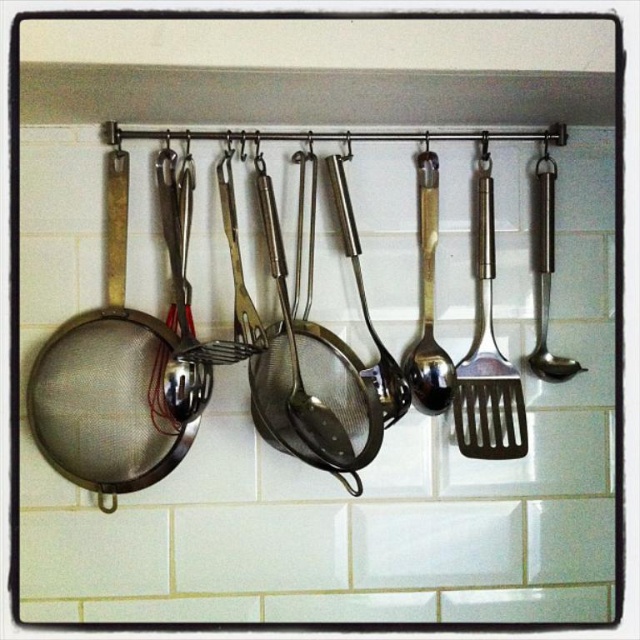
Question: Which of the following is the farthest from the observer?

Choices:
 (A) satin gold spoon at center
 (B) satin silver mesh strainer at center
 (C) satin silver strainer at center

Answer: (A)

Question: Is satin gold spoon at center further to camera compared to satin silver spoon at center?

Choices:
 (A) no
 (B) yes

Answer: (A)

Question: Which object is closer to the camera taking this photo?

Choices:
 (A) satin silver strainer at center
 (B) satin gold spoon at center
 (C) satin silver mesh strainer at center

Answer: (C)

Question: Is satin silver spoon at center to the left of satin silver strainer at center from the viewer's perspective?

Choices:
 (A) yes
 (B) no

Answer: (B)

Question: Can you confirm if satin silver spatula at center is bigger than satin silver strainer at center?

Choices:
 (A) yes
 (B) no

Answer: (B)

Question: Which point is farther to the camera?

Choices:
 (A) satin silver mesh strainer at center
 (B) satin silver spoon at center

Answer: (B)